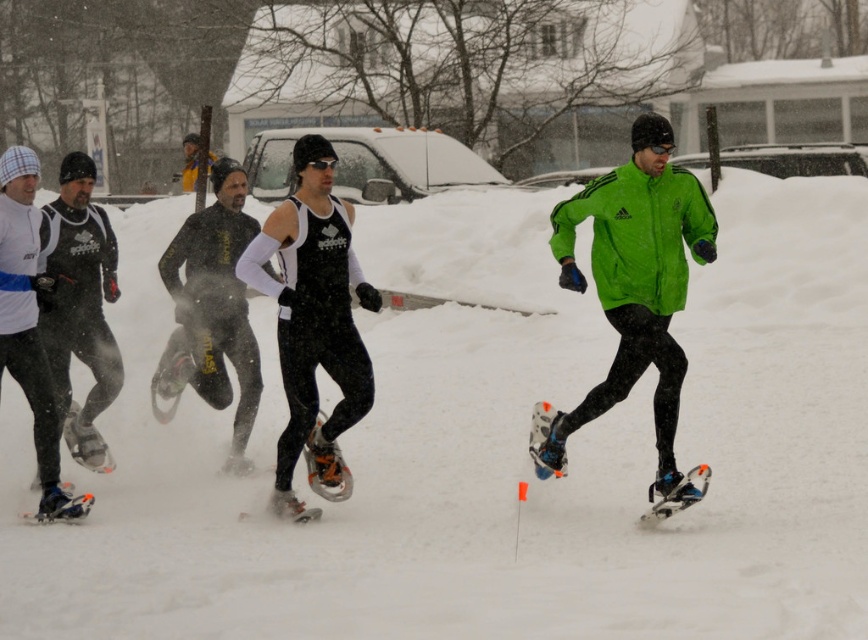
Does point (671, 416) lie behind point (45, 218)?

No.

Measure the distance from green matte jacket at center to matte black snowshoes at left.

They are 3.55 meters apart.

Locate an element on the screen. The image size is (868, 640). green matte jacket at center is located at coordinates (635, 284).

Image resolution: width=868 pixels, height=640 pixels. Identify the location of green matte jacket at center. (635, 284).

This screenshot has width=868, height=640. What do you see at coordinates (313, 321) in the screenshot?
I see `matte black ski suit at center` at bounding box center [313, 321].

Is matte black ski suit at center wider than matte black snowshoes at left?

Yes, matte black ski suit at center is wider than matte black snowshoes at left.

Is point (288, 356) in front of point (97, 310)?

That is True.

You are a GUI agent. You are given a task and a screenshot of the screen. Output one action in this format:
    pyautogui.click(x=<x>, y=<y>)
    Task: Click on the matte black ski suit at center
    
    Given the screenshot: What is the action you would take?
    pyautogui.click(x=313, y=321)

Can you confirm if green matte jacket at center is wider than matte black ski suit at center?

Correct, the width of green matte jacket at center exceeds that of matte black ski suit at center.

Consider the image. Can you confirm if green matte jacket at center is smaller than matte black ski suit at center?

No, green matte jacket at center is not smaller than matte black ski suit at center.

Where is `green matte jacket at center`? The image size is (868, 640). green matte jacket at center is located at coordinates (635, 284).